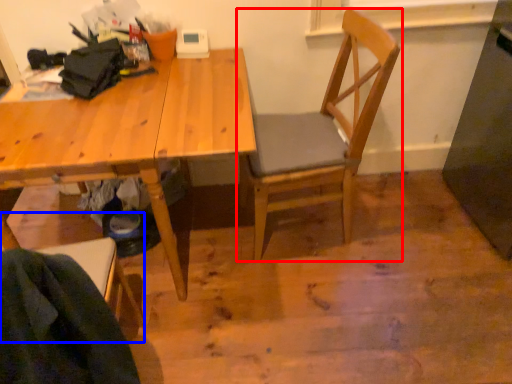
Question: Which object is further to the camera taking this photo, chair (highlighted by a red box) or chair (highlighted by a blue box)?

Choices:
 (A) chair
 (B) chair

Answer: (A)